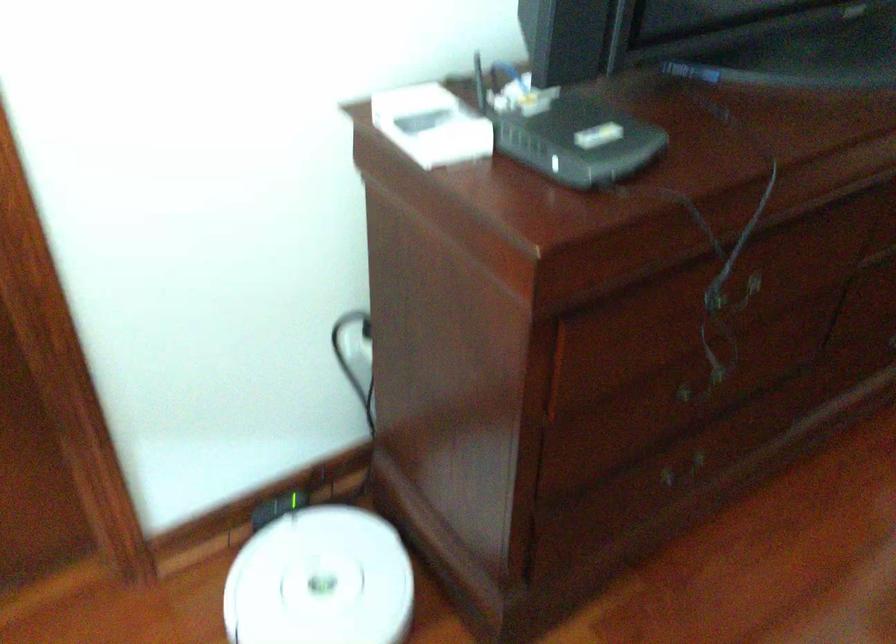
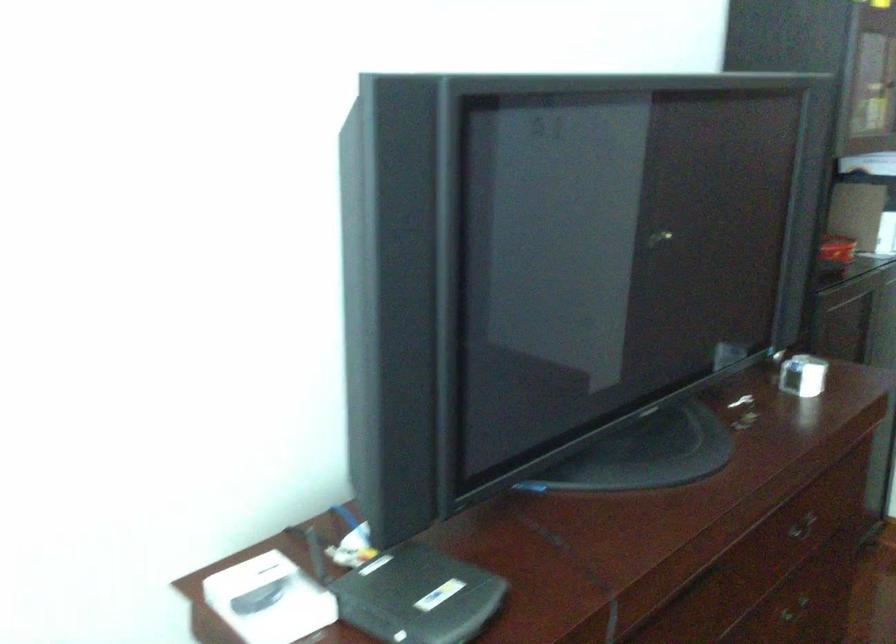
In a continuous first-person perspective shot, in which direction is the camera moving?

The cameraman walked toward right, backward.